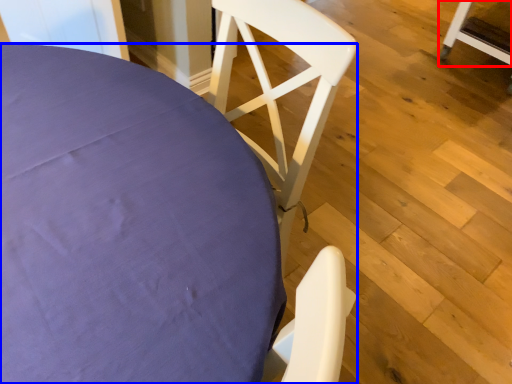
Question: Among these objects, which one is nearest to the camera, chair (highlighted by a red box) or chair (highlighted by a blue box)?

Choices:
 (A) chair
 (B) chair

Answer: (B)